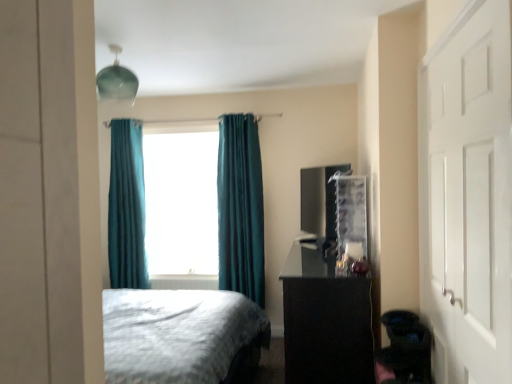
Question: Which direction should I rotate to look at teal velvet curtain at center, the second curtain viewed from the right?

Choices:
 (A) left
 (B) right

Answer: (A)

Question: Could you tell me if teal fabric curtain at center is turned towards white matte door at right?

Choices:
 (A) no
 (B) yes

Answer: (A)

Question: From the image's perspective, would you say teal fabric curtain at center is positioned over white matte door at right?

Choices:
 (A) no
 (B) yes

Answer: (B)

Question: Would you consider teal fabric curtain at center to be distant from white matte door at right?

Choices:
 (A) no
 (B) yes

Answer: (B)

Question: From a real-world perspective, is teal fabric curtain at center over white matte door at right?

Choices:
 (A) no
 (B) yes

Answer: (B)

Question: Is teal fabric curtain at center positioned beyond the bounds of white matte door at right?

Choices:
 (A) no
 (B) yes

Answer: (B)

Question: Is white matte door at right at the back of teal fabric curtain at center?

Choices:
 (A) no
 (B) yes

Answer: (A)

Question: Does teal fabric curtain at center have a smaller size compared to black glossy vanity at right?

Choices:
 (A) no
 (B) yes

Answer: (B)

Question: From the image's perspective, is teal fabric curtain at center above black glossy vanity at right?

Choices:
 (A) yes
 (B) no

Answer: (A)

Question: Does teal fabric curtain at center contain black glossy vanity at right?

Choices:
 (A) yes
 (B) no

Answer: (B)

Question: From a real-world perspective, is teal fabric curtain at center under black glossy vanity at right?

Choices:
 (A) yes
 (B) no

Answer: (B)

Question: Is teal fabric curtain at center at the right side of black glossy vanity at right?

Choices:
 (A) yes
 (B) no

Answer: (B)

Question: Are teal fabric curtain at center and black glossy vanity at right far apart?

Choices:
 (A) yes
 (B) no

Answer: (A)

Question: Is teal velvet curtain at center, the 1th curtain in the left-to-right sequence, positioned far away from teal fabric curtain at center?

Choices:
 (A) no
 (B) yes

Answer: (A)